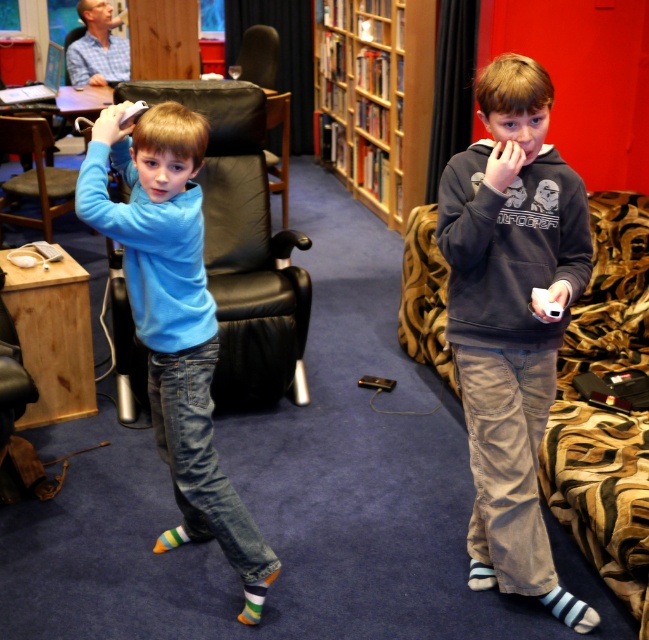
Question: Which point is farther to the camera?

Choices:
 (A) wooden bookshelf at center
 (B) dark gray hoodie at center
 (C) black leather chair at center
 (D) dark gray hoodie at right

Answer: (C)

Question: Which of these objects is positioned farthest from the dark gray hoodie at right?

Choices:
 (A) black leather chair at left
 (B) dark gray hoodie at center
 (C) wooden bookshelf at center
 (D) blue cotton shirt at center

Answer: (C)

Question: Among these objects, which one is farthest from the camera?

Choices:
 (A) dark gray hoodie at right
 (B) wooden bookshelf at center

Answer: (B)

Question: Can you confirm if black leather armchair at center is positioned below black leather chair at left?

Choices:
 (A) yes
 (B) no

Answer: (A)

Question: Can you confirm if dark gray hoodie at center is smaller than wooden bookshelf at center?

Choices:
 (A) yes
 (B) no

Answer: (A)

Question: Does dark gray hoodie at right have a lesser width compared to black leather chair at center?

Choices:
 (A) no
 (B) yes

Answer: (B)